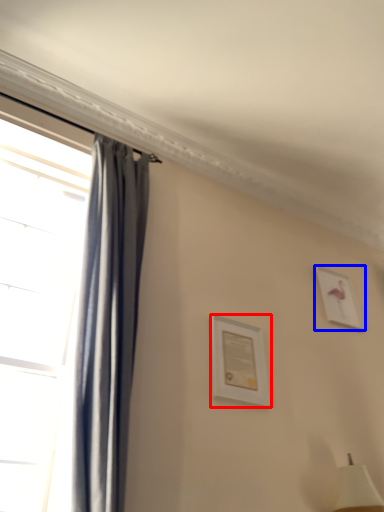
Question: Which object is further to the camera taking this photo, picture frame (highlighted by a red box) or picture frame (highlighted by a blue box)?

Choices:
 (A) picture frame
 (B) picture frame

Answer: (B)